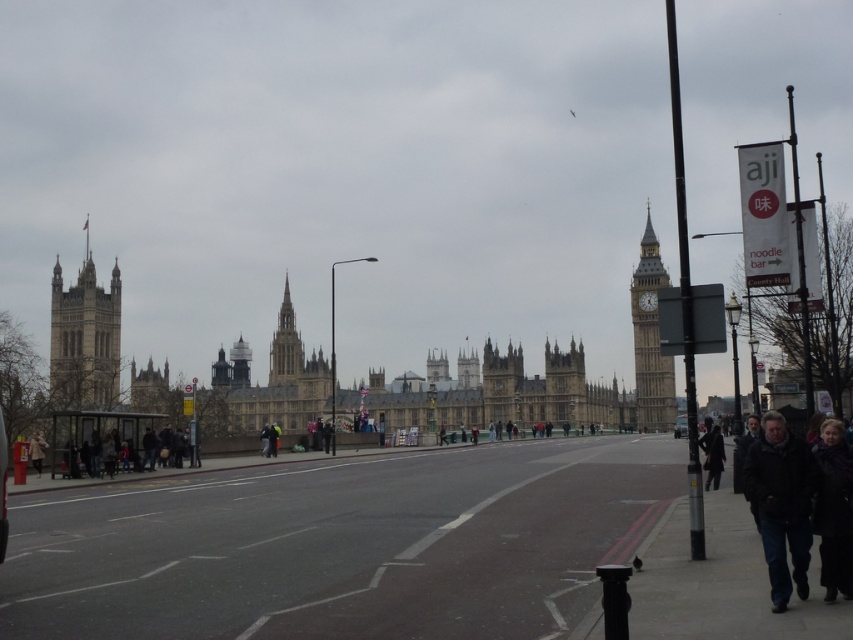
Is stone tower at left to the right of dark brown coat at lower right from the viewer's perspective?

No, stone tower at left is not to the right of dark brown coat at lower right.

Who is higher up, stone tower at left or dark brown coat at lower right?

stone tower at left is higher up.

Locate an element on the screen. stone tower at left is located at coordinates (84, 339).

Is dark fur coat at lower right bigger than dark brown coat at lower right?

Incorrect, dark fur coat at lower right is not larger than dark brown coat at lower right.

Who is lower down, dark fur coat at lower right or dark brown coat at lower right?

dark fur coat at lower right is lower down.

Is point (827, 566) positioned in front of point (706, 440)?

That is True.

Locate an element on the screen. dark fur coat at lower right is located at coordinates (834, 509).

Does golden stone clock tower at right lie behind smooth stone spire at center?

No.

Between golden stone clock tower at right and smooth stone spire at center, which one is positioned lower?

smooth stone spire at center is lower down.

Between point (650, 360) and point (286, 365), which one is positioned behind?

The point (286, 365) is behind.

Where is `golden stone clock tower at right`? Image resolution: width=853 pixels, height=640 pixels. golden stone clock tower at right is located at coordinates pos(650,339).